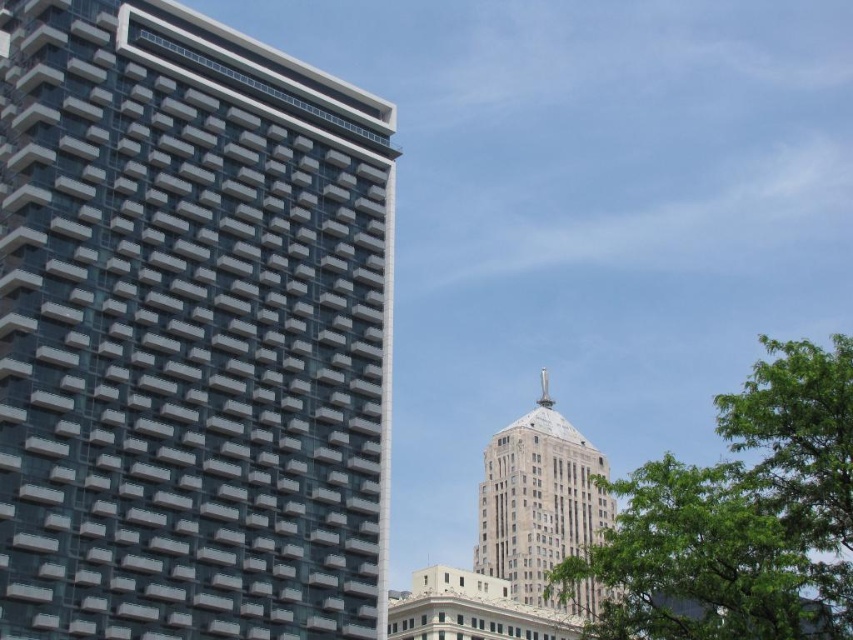
Question: Which point is closer to the camera?

Choices:
 (A) glassy reflective building at left
 (B) green leafy tree at center right
 (C) gray stone tower at center

Answer: (B)

Question: In this image, where is glassy reflective building at left located relative to green leafy tree at center right?

Choices:
 (A) above
 (B) below

Answer: (A)

Question: Is glassy reflective building at left further to camera compared to gray stone tower at center?

Choices:
 (A) yes
 (B) no

Answer: (A)

Question: Can you confirm if glassy reflective building at left is smaller than gray stone tower at center?

Choices:
 (A) no
 (B) yes

Answer: (B)

Question: Estimate the real-world distances between objects in this image. Which object is closer to the glassy reflective building at left?

Choices:
 (A) gray stone tower at center
 (B) green leafy tree at center right

Answer: (B)

Question: Among these objects, which one is farthest from the camera?

Choices:
 (A) green leafy tree at center right
 (B) glassy reflective building at left
 (C) gray stone tower at center

Answer: (B)